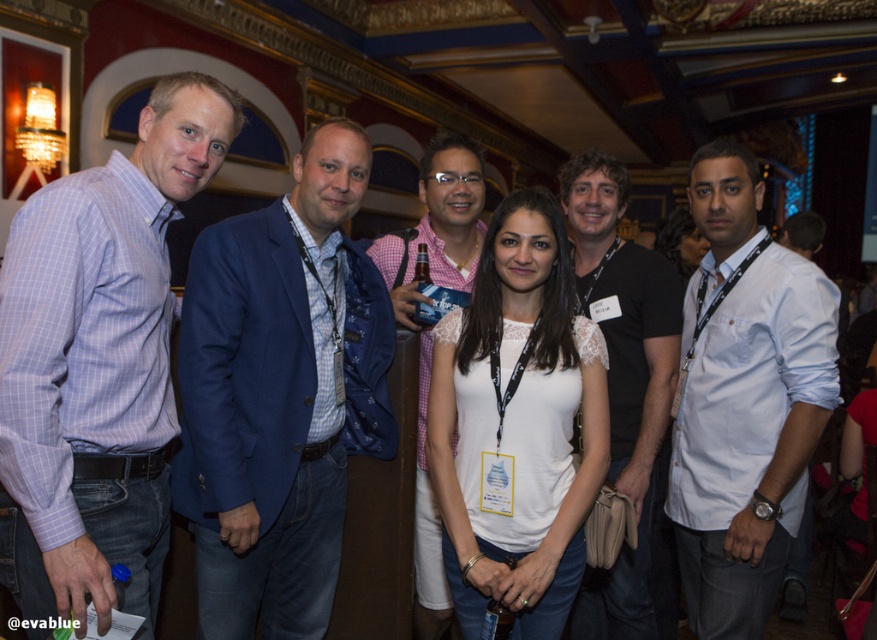
The width and height of the screenshot is (877, 640). What do you see at coordinates (744, 400) in the screenshot? I see `white cotton shirt at right` at bounding box center [744, 400].

The image size is (877, 640). What do you see at coordinates (744, 400) in the screenshot? I see `white cotton shirt at right` at bounding box center [744, 400].

What are the coordinates of `white cotton shirt at right` in the screenshot? It's located at (744, 400).

Between matte purple shirt at left and white cotton shirt at right, which one has less height?

Standing shorter between the two is matte purple shirt at left.

Where is `matte purple shirt at left`? The height and width of the screenshot is (640, 877). matte purple shirt at left is located at coordinates tap(98, 362).

Where is `matte purple shirt at left`? The image size is (877, 640). matte purple shirt at left is located at coordinates (98, 362).

Which is behind, point (746, 317) or point (640, 289)?

The point (640, 289) is behind.

Which is more to the left, white cotton shirt at right or black cotton t-shirt at center?

black cotton t-shirt at center

The image size is (877, 640). Find the location of `white cotton shirt at right`. white cotton shirt at right is located at coordinates (744, 400).